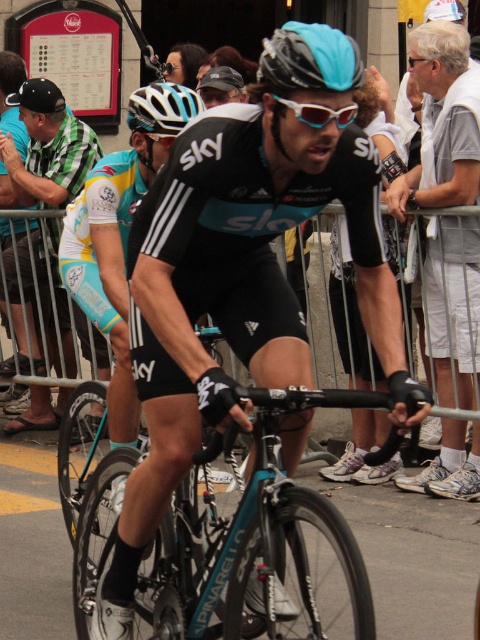
Question: Which object is the farthest from the white translucent goggles at center?

Choices:
 (A) white cotton shirt at right
 (B) teal glossy bicycle at center
 (C) light blue jersey at left

Answer: (C)

Question: Which of the following is the farthest from the observer?

Choices:
 (A) light blue jersey at left
 (B) matte black bicycle at center

Answer: (A)

Question: Is matte blue bicycle helmet at center to the right of white translucent goggles at center from the viewer's perspective?

Choices:
 (A) no
 (B) yes

Answer: (A)

Question: Is matte black bicycle at center positioned behind white cotton shirt at right?

Choices:
 (A) no
 (B) yes

Answer: (A)

Question: Which of the following is the farthest from the observer?

Choices:
 (A) (300, 116)
 (B) (231, 545)
 (C) (170, 83)
 (D) (238, 177)

Answer: (C)

Question: Is teal glossy bicycle at center behind white translucent goggles at center?

Choices:
 (A) no
 (B) yes

Answer: (A)